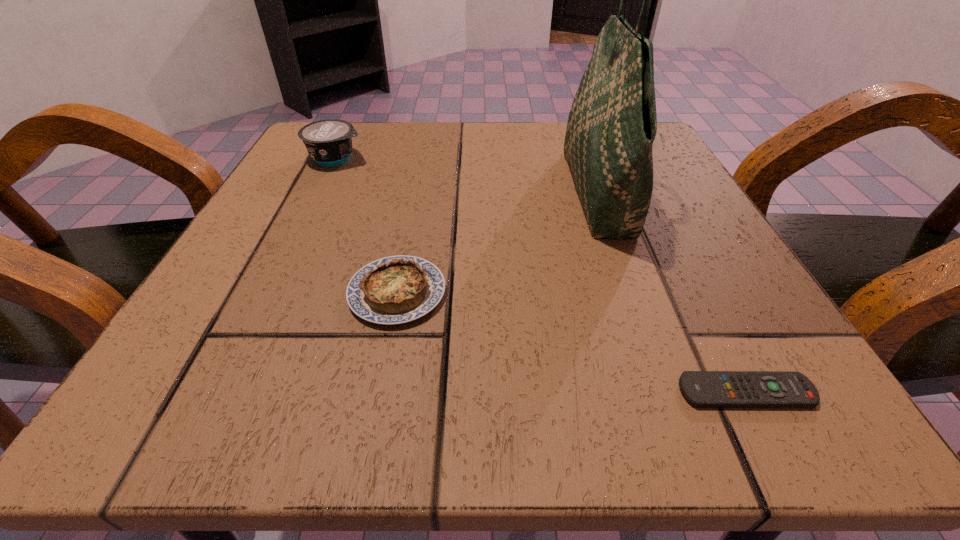
Find the location of a particular element. This screenshot has height=540, width=960. vacant space located on the left of the nearest object is located at coordinates [x=634, y=392].

At what (x,y) coordinates should I click in order to perform the action: click on tote bag present at the far edge. Please return your answer as a coordinate pair (x, y). Looking at the image, I should click on (612, 124).

Where is `yogurt positioned at the far edge`? The image size is (960, 540). yogurt positioned at the far edge is located at coordinates (329, 142).

Where is `object present at the near edge`? object present at the near edge is located at coordinates (704, 389).

The width and height of the screenshot is (960, 540). I want to click on object present at the left edge, so click(329, 142).

Identify the location of tote bag that is at the right edge. This screenshot has width=960, height=540. (612, 124).

The image size is (960, 540). I want to click on remote control that is positioned at the right edge, so click(x=704, y=389).

I want to click on object located at the far left corner, so click(x=329, y=142).

Find the location of a particular element. The width and height of the screenshot is (960, 540). object that is at the far right corner is located at coordinates (612, 124).

Identify the location of object present at the near right corner. (704, 389).